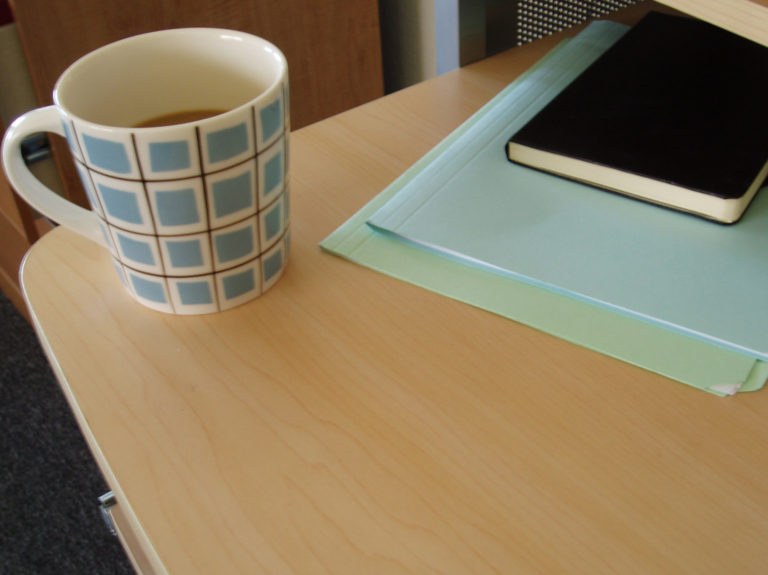
Identify the location of wood table. The image size is (768, 575). tap(477, 465).